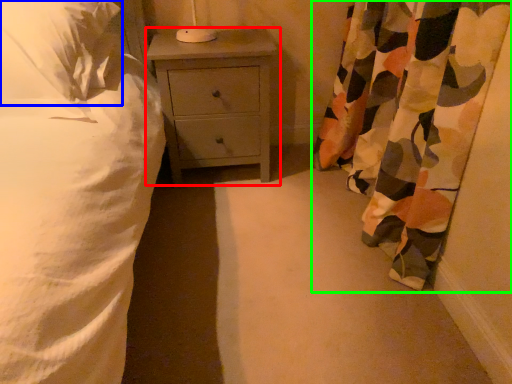
Question: Which object is the closest to the nightstand (highlighted by a red box)? Choose among these: pillow (highlighted by a blue box) or curtain (highlighted by a green box).

Choices:
 (A) pillow
 (B) curtain

Answer: (A)